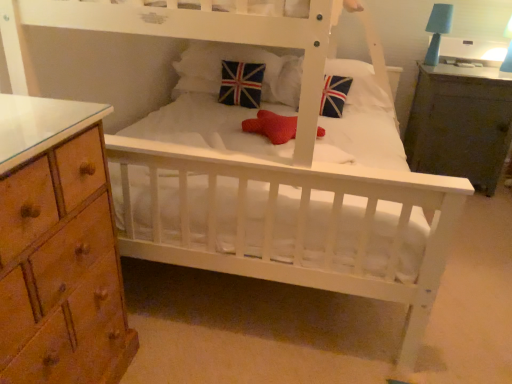
Question: Considering the positions of union jack fabric pillow at center, which is the first pillow from left to right, and dark wood nightstand at right in the image, is union jack fabric pillow at center, which is the first pillow from left to right, bigger or smaller than dark wood nightstand at right?

Choices:
 (A) big
 (B) small

Answer: (B)

Question: Considering the positions of union jack fabric pillow at center, which is the first pillow from left to right, and dark wood nightstand at right in the image, is union jack fabric pillow at center, which is the first pillow from left to right, wider or thinner than dark wood nightstand at right?

Choices:
 (A) wide
 (B) thin

Answer: (B)

Question: Which object is positioned farthest from the union jack fabric pillow at center?

Choices:
 (A) velvet union jack pillow at center, the 2th pillow positioned from the left
 (B) blue matte table lamp at upper right
 (C) red mesh star at center
 (D) union jack fabric pillow at center, which is the first pillow from left to right
 (E) dark wood nightstand at right

Answer: (B)

Question: Based on their relative distances, which object is farther from the velvet union jack pillow at center, which is the 1th pillow from right to left?

Choices:
 (A) red mesh star at center
 (B) blue matte table lamp at upper right
 (C) dark wood nightstand at right
 (D) union jack fabric pillow at center
 (E) union jack fabric pillow at center, the 2th pillow viewed from the right

Answer: (B)